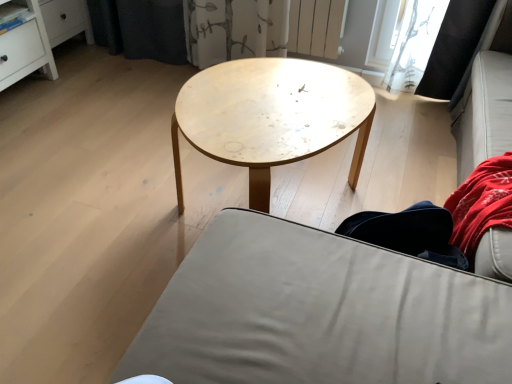
Where is `blank space to the left of natural wood coffee table at center`? This screenshot has height=384, width=512. blank space to the left of natural wood coffee table at center is located at coordinates (101, 211).